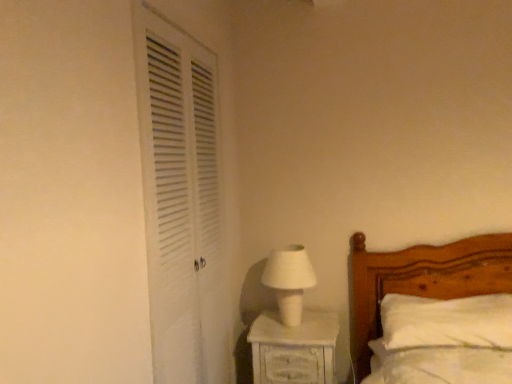
Question: Does white soft pillow at lower right turn towards white louvered door at left?

Choices:
 (A) yes
 (B) no

Answer: (B)

Question: Does white soft pillow at lower right have a smaller size compared to white louvered door at left?

Choices:
 (A) yes
 (B) no

Answer: (A)

Question: Is white louvered door at left located within white soft pillow at lower right?

Choices:
 (A) yes
 (B) no

Answer: (B)

Question: From a real-world perspective, is white soft pillow at lower right under white louvered door at left?

Choices:
 (A) no
 (B) yes

Answer: (B)

Question: Considering the relative positions of white soft pillow at lower right and white louvered door at left in the image provided, is white soft pillow at lower right to the right of white louvered door at left from the viewer's perspective?

Choices:
 (A) yes
 (B) no

Answer: (A)

Question: Does white soft pillow at lower right have a lesser height compared to white louvered door at left?

Choices:
 (A) yes
 (B) no

Answer: (A)

Question: Is white matte table lamp at center facing towards white louvered door at left?

Choices:
 (A) no
 (B) yes

Answer: (A)

Question: From a real-world perspective, is white matte table lamp at center physically below white louvered door at left?

Choices:
 (A) yes
 (B) no

Answer: (A)

Question: Is white louvered door at left a part of white matte table lamp at center?

Choices:
 (A) no
 (B) yes

Answer: (A)

Question: Can you confirm if white matte table lamp at center is wider than white louvered door at left?

Choices:
 (A) yes
 (B) no

Answer: (A)

Question: From the image's perspective, is white matte table lamp at center located beneath white louvered door at left?

Choices:
 (A) no
 (B) yes

Answer: (B)

Question: Considering the relative positions of white matte table lamp at center and white louvered door at left in the image provided, is white matte table lamp at center to the right of white louvered door at left from the viewer's perspective?

Choices:
 (A) yes
 (B) no

Answer: (A)

Question: Does white painted wood nightstand at lower right appear on the left side of white louvered door at left?

Choices:
 (A) no
 (B) yes

Answer: (A)